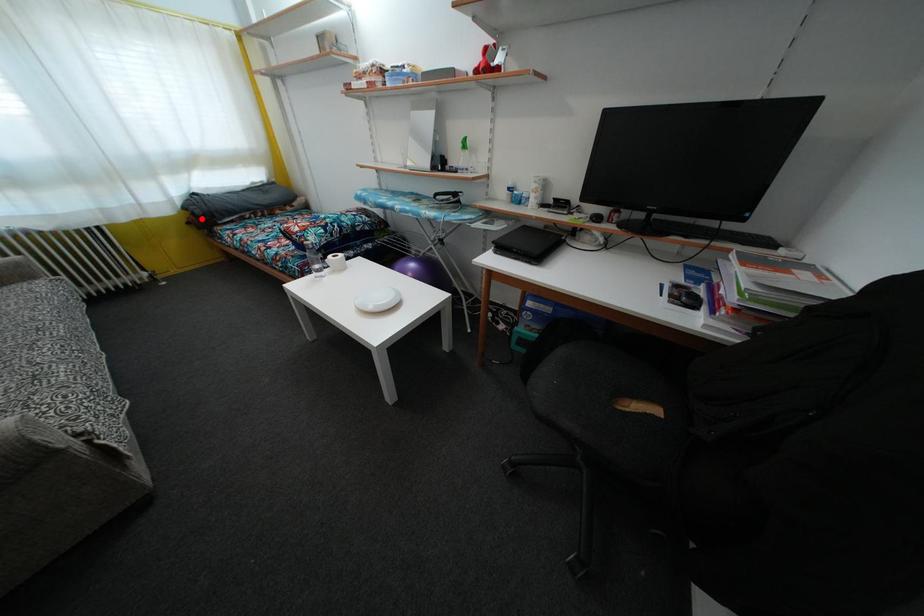
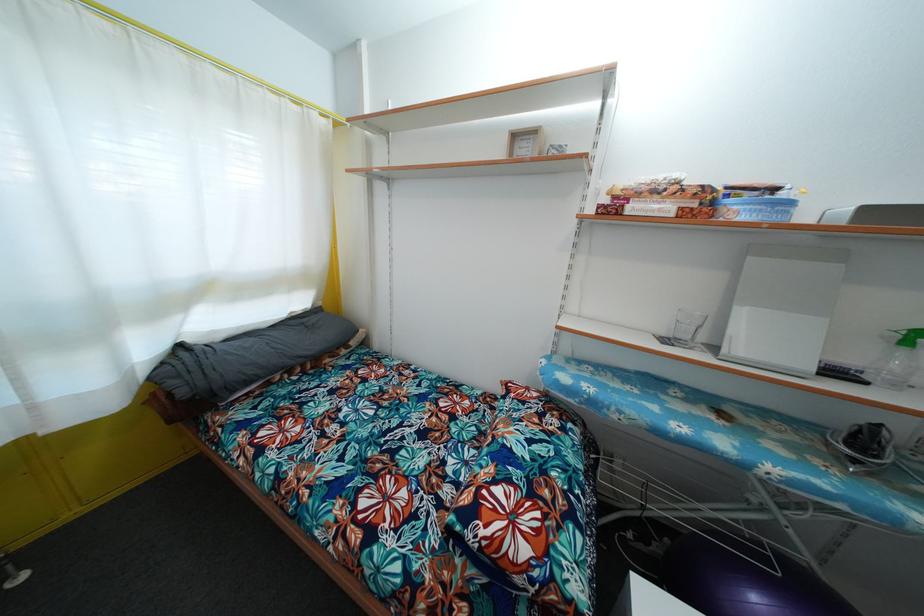
Where in the second image is the point corresponding to the highlighted location from the first image?

(187, 399)